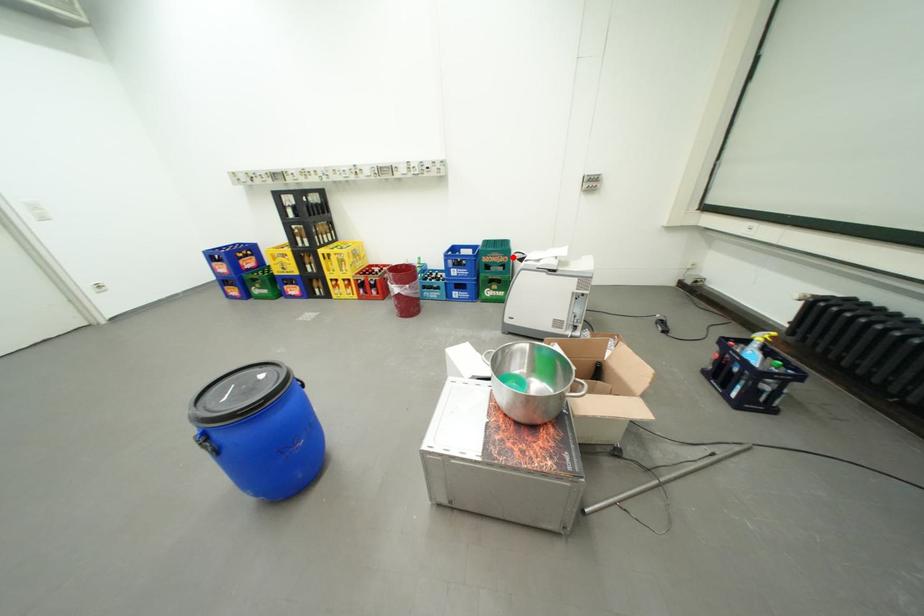
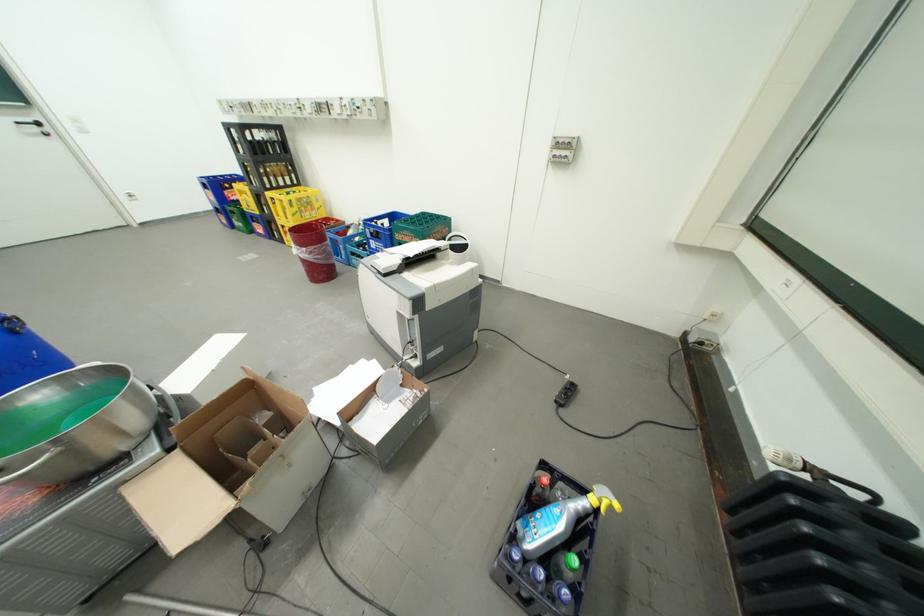
Find the pixel in the second image that matches the highlighted location in the first image.

(424, 238)